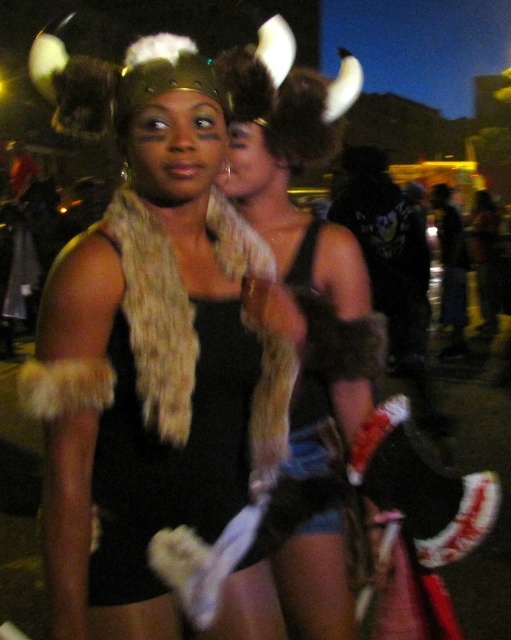
You are standing in front of the two Viking costume wearers. You want to touch the point closer to you between the two points labeled as point [146,404] and point [446,356]. Which point should you reach for?

You should reach for point [146,404] because it is closer to the viewer than point [446,356].